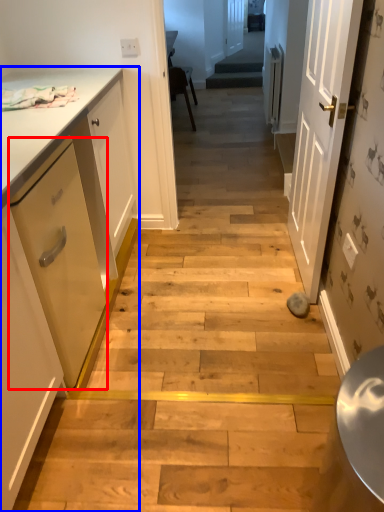
Question: Which object appears farthest to the camera in this image, drawer (highlighted by a red box) or cabinetry (highlighted by a blue box)?

Choices:
 (A) drawer
 (B) cabinetry

Answer: (A)